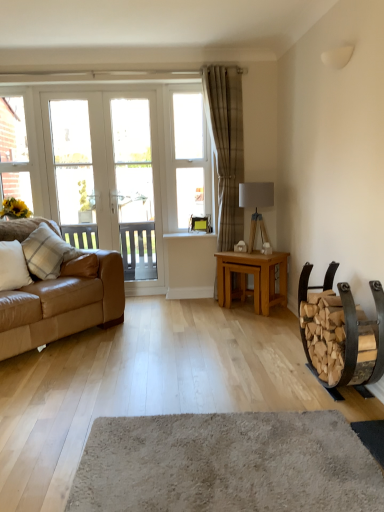
Question: Does soft beige carpet at center have a lesser width compared to wooden log rack at right?

Choices:
 (A) yes
 (B) no

Answer: (B)

Question: Is soft beige carpet at center in front of wooden log rack at right?

Choices:
 (A) yes
 (B) no

Answer: (A)

Question: Is soft beige carpet at center far from wooden log rack at right?

Choices:
 (A) no
 (B) yes

Answer: (A)

Question: Considering the relative positions of soft beige carpet at center and wooden log rack at right in the image provided, is soft beige carpet at center to the right of wooden log rack at right from the viewer's perspective?

Choices:
 (A) yes
 (B) no

Answer: (B)

Question: Considering the relative sizes of soft beige carpet at center and wooden log rack at right in the image provided, is soft beige carpet at center smaller than wooden log rack at right?

Choices:
 (A) yes
 (B) no

Answer: (A)

Question: Is soft beige carpet at center located outside wooden log rack at right?

Choices:
 (A) yes
 (B) no

Answer: (A)

Question: From a real-world perspective, is leather couch at left below soft beige carpet at center?

Choices:
 (A) yes
 (B) no

Answer: (B)

Question: From the image's perspective, is leather couch at left located above soft beige carpet at center?

Choices:
 (A) no
 (B) yes

Answer: (B)

Question: Does leather couch at left have a lesser width compared to soft beige carpet at center?

Choices:
 (A) no
 (B) yes

Answer: (B)

Question: From a real-world perspective, is leather couch at left over soft beige carpet at center?

Choices:
 (A) yes
 (B) no

Answer: (A)

Question: Does leather couch at left have a larger size compared to soft beige carpet at center?

Choices:
 (A) no
 (B) yes

Answer: (B)

Question: Are leather couch at left and soft beige carpet at center far apart?

Choices:
 (A) no
 (B) yes

Answer: (B)

Question: Does plaid fabric pillow at left, marked as the 1th pillow in a back-to-front arrangement, come in front of beige textured curtain at center?

Choices:
 (A) no
 (B) yes

Answer: (B)